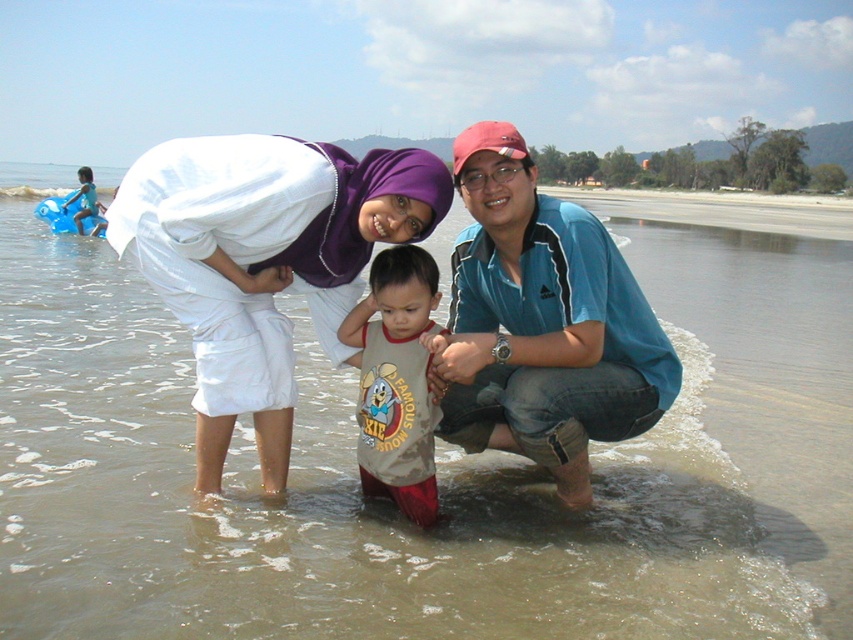
Does clear water at lower center have a lesser height compared to white cotton hijab at upper left?

In fact, clear water at lower center may be taller than white cotton hijab at upper left.

Locate an element on the screen. This screenshot has width=853, height=640. clear water at lower center is located at coordinates [x=437, y=467].

Does white cotton hijab at upper left appear over light brown cotton shirt at center?

Correct, white cotton hijab at upper left is located above light brown cotton shirt at center.

Is white cotton hijab at upper left in front of light brown cotton shirt at center?

Yes, white cotton hijab at upper left is closer to the viewer.

Between point (198, 240) and point (405, 316), which one is positioned in front?

Positioned in front is point (198, 240).

You are a GUI agent. You are given a task and a screenshot of the screen. Output one action in this format:
    pyautogui.click(x=<x>, y=<y>)
    Task: Click on the white cotton hijab at upper left
    This screenshot has width=853, height=640.
    Given the screenshot: What is the action you would take?
    pyautogui.click(x=368, y=259)

Which is above, white cotton hijab at upper left or blue cotton shirt at center?

blue cotton shirt at center is higher up.

Is white cotton hijab at upper left bigger than blue cotton shirt at center?

Indeed, white cotton hijab at upper left has a larger size compared to blue cotton shirt at center.

Identify the location of white cotton hijab at upper left. The height and width of the screenshot is (640, 853). (368, 259).